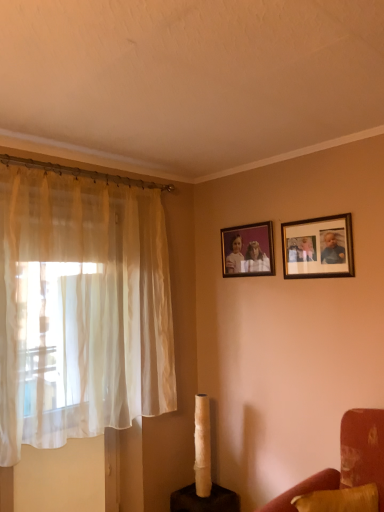
I want to click on matte wooden picture frame at upper center, which is counted as the 1th picture frame, starting from the back, so click(248, 250).

This screenshot has height=512, width=384. Describe the element at coordinates (248, 250) in the screenshot. I see `matte wooden picture frame at upper center, which is counted as the second picture frame, starting from the right` at that location.

You are a GUI agent. You are given a task and a screenshot of the screen. Output one action in this format:
    pyautogui.click(x=<x>, y=<y>)
    Task: Click on the velvet red couch at lower right
    
    Given the screenshot: What is the action you would take?
    pyautogui.click(x=304, y=490)

Based on the photo, is wooden photo frame at upper right, the second picture frame viewed from the back, further to camera compared to velvet red armchair at lower right?

Yes, the depth of wooden photo frame at upper right, the second picture frame viewed from the back, is greater than that of velvet red armchair at lower right.

Considering the relative positions of wooden photo frame at upper right, marked as the 1th picture frame in a front-to-back arrangement, and velvet red armchair at lower right in the image provided, is wooden photo frame at upper right, marked as the 1th picture frame in a front-to-back arrangement, to the right of velvet red armchair at lower right from the viewer's perspective?

Yes, wooden photo frame at upper right, marked as the 1th picture frame in a front-to-back arrangement, is to the right of velvet red armchair at lower right.

From the image's perspective, is wooden photo frame at upper right, the second picture frame when ordered from left to right, positioned above or below velvet red armchair at lower right?

Based on their image positions, wooden photo frame at upper right, the second picture frame when ordered from left to right, is located above velvet red armchair at lower right.

Is sheer white curtain at left positioned in front of velvet red couch at lower right?

That is False.

Is sheer white curtain at left inside the boundaries of velvet red couch at lower right, or outside?

sheer white curtain at left is spatially situated outside velvet red couch at lower right.

Does sheer white curtain at left have a larger size compared to velvet red couch at lower right?

Yes, sheer white curtain at left is bigger than velvet red couch at lower right.

Is sheer white curtain at left facing towards velvet red couch at lower right?

Yes, sheer white curtain at left is turned towards velvet red couch at lower right.

What's the angular difference between velvet red armchair at lower right and matte wooden picture frame at upper center, which is counted as the 1th picture frame, starting from the back,'s facing directions?

There is a 0.02-degree angle between the facing directions of velvet red armchair at lower right and matte wooden picture frame at upper center, which is counted as the 1th picture frame, starting from the back.

Is velvet red armchair at lower right behind matte wooden picture frame at upper center, which is counted as the 1th picture frame, starting from the back?

No, velvet red armchair at lower right is closer to the viewer.

Do you think velvet red armchair at lower right is within matte wooden picture frame at upper center, placed as the 1th picture frame when sorted from left to right, or outside of it?

velvet red armchair at lower right exists outside the volume of matte wooden picture frame at upper center, placed as the 1th picture frame when sorted from left to right.

Is velvet red armchair at lower right wider or thinner than matte wooden picture frame at upper center, placed as the 1th picture frame when sorted from left to right?

velvet red armchair at lower right is wider than matte wooden picture frame at upper center, placed as the 1th picture frame when sorted from left to right.

Which object is wider, wooden photo frame at upper right, the second picture frame viewed from the back, or matte wooden picture frame at upper center, which is counted as the 1th picture frame, starting from the back?

matte wooden picture frame at upper center, which is counted as the 1th picture frame, starting from the back, is wider.

From the image's perspective, which one is positioned higher, wooden photo frame at upper right, marked as the 1th picture frame in a front-to-back arrangement, or matte wooden picture frame at upper center, which is the 2th picture frame in front-to-back order?

matte wooden picture frame at upper center, which is the 2th picture frame in front-to-back order.

Is the position of wooden photo frame at upper right, which appears as the 1th picture frame when viewed from the right, more distant than that of matte wooden picture frame at upper center, which is counted as the second picture frame, starting from the right?

No, wooden photo frame at upper right, which appears as the 1th picture frame when viewed from the right, is in front of matte wooden picture frame at upper center, which is counted as the second picture frame, starting from the right.

Is wooden photo frame at upper right, which appears as the 1th picture frame when viewed from the right, at the back of velvet red armchair at lower right?

velvet red armchair at lower right is not turned away from wooden photo frame at upper right, which appears as the 1th picture frame when viewed from the right.

Considering the positions of points (383, 455) and (353, 262), is point (383, 455) closer to camera compared to point (353, 262)?

Yes, point (383, 455) is closer to viewer.

Does velvet red armchair at lower right touch wooden photo frame at upper right, the second picture frame when ordered from left to right?

They are not placed beside each other.

From the image's perspective, which is below, velvet red armchair at lower right or wooden photo frame at upper right, marked as the 1th picture frame in a front-to-back arrangement?

velvet red armchair at lower right appears lower in the image.

Is velvet red couch at lower right next to velvet red armchair at lower right and touching it?

No, velvet red couch at lower right is not with velvet red armchair at lower right.

Considering the points (327, 481) and (268, 509), which point is in front, point (327, 481) or point (268, 509)?

The point (268, 509) is closer to the camera.

Is velvet red couch at lower right smaller than velvet red armchair at lower right?

Yes, velvet red couch at lower right is smaller than velvet red armchair at lower right.

Relative to velvet red armchair at lower right, is velvet red couch at lower right in front or behind?

velvet red couch at lower right is positioned farther from the viewer than velvet red armchair at lower right.

From the image's perspective, does matte wooden picture frame at upper center, which is counted as the second picture frame, starting from the right, appear higher than velvet red couch at lower right?

Yes, from the image's perspective, matte wooden picture frame at upper center, which is counted as the second picture frame, starting from the right, is over velvet red couch at lower right.

In terms of width, does matte wooden picture frame at upper center, placed as the 1th picture frame when sorted from left to right, look wider or thinner when compared to velvet red couch at lower right?

Considering their sizes, matte wooden picture frame at upper center, placed as the 1th picture frame when sorted from left to right, looks slimmer than velvet red couch at lower right.

Does matte wooden picture frame at upper center, placed as the 1th picture frame when sorted from left to right, appear on the left side of velvet red couch at lower right?

Indeed, matte wooden picture frame at upper center, placed as the 1th picture frame when sorted from left to right, is positioned on the left side of velvet red couch at lower right.

Are matte wooden picture frame at upper center, which is the 2th picture frame in front-to-back order, and velvet red couch at lower right located far from each other?

Yes, matte wooden picture frame at upper center, which is the 2th picture frame in front-to-back order, and velvet red couch at lower right are quite far apart.

The width and height of the screenshot is (384, 512). I want to click on furniture below the wooden photo frame at upper right, the second picture frame viewed from the back (from a real-world perspective), so click(x=347, y=460).

At what (x,y) coordinates should I click in order to perform the action: click on couch below the sheer white curtain at left (from the image's perspective). Please return your answer as a coordinate pair (x, y). Looking at the image, I should click on (304, 490).

From the image, which object appears to be nearer to wooden photo frame at upper right, the second picture frame viewed from the back, sheer white curtain at left or matte wooden picture frame at upper center, placed as the 1th picture frame when sorted from left to right?

Among the two, matte wooden picture frame at upper center, placed as the 1th picture frame when sorted from left to right, is located nearer to wooden photo frame at upper right, the second picture frame viewed from the back.

From the image, which object appears to be farther from wooden photo frame at upper right, which appears as the 1th picture frame when viewed from the right, velvet red armchair at lower right or matte wooden picture frame at upper center, placed as the 1th picture frame when sorted from left to right?

Based on the image, velvet red armchair at lower right appears to be further to wooden photo frame at upper right, which appears as the 1th picture frame when viewed from the right.

When comparing their distances from wooden photo frame at upper right, marked as the 1th picture frame in a front-to-back arrangement, does velvet red couch at lower right or sheer white curtain at left seem further?

Among the two, velvet red couch at lower right is located further to wooden photo frame at upper right, marked as the 1th picture frame in a front-to-back arrangement.

Estimate the real-world distances between objects in this image. Which object is closer to matte wooden picture frame at upper center, placed as the 1th picture frame when sorted from left to right, velvet red armchair at lower right or velvet red couch at lower right?

The object closer to matte wooden picture frame at upper center, placed as the 1th picture frame when sorted from left to right, is velvet red armchair at lower right.

Based on their spatial positions, is wooden photo frame at upper right, the second picture frame when ordered from left to right, or matte wooden picture frame at upper center, placed as the 1th picture frame when sorted from left to right, closer to velvet red armchair at lower right?

wooden photo frame at upper right, the second picture frame when ordered from left to right, is closer to velvet red armchair at lower right.

Looking at the image, which one is located further to matte wooden picture frame at upper center, which is the 2th picture frame in front-to-back order, sheer white curtain at left or velvet red armchair at lower right?

velvet red armchair at lower right is positioned further to the anchor matte wooden picture frame at upper center, which is the 2th picture frame in front-to-back order.

When comparing their distances from velvet red couch at lower right, does matte wooden picture frame at upper center, which is counted as the 1th picture frame, starting from the back, or sheer white curtain at left seem closer?

The object closer to velvet red couch at lower right is matte wooden picture frame at upper center, which is counted as the 1th picture frame, starting from the back.

Estimate the real-world distances between objects in this image. Which object is further from velvet red couch at lower right, sheer white curtain at left or velvet red armchair at lower right?

Based on the image, sheer white curtain at left appears to be further to velvet red couch at lower right.

This screenshot has height=512, width=384. I want to click on curtain located between velvet red armchair at lower right and matte wooden picture frame at upper center, which is counted as the second picture frame, starting from the right, in the depth direction, so click(x=81, y=309).

The height and width of the screenshot is (512, 384). I want to click on couch between sheer white curtain at left and velvet red armchair at lower right in the horizontal direction, so click(304, 490).

The image size is (384, 512). Identify the location of picture frame located between sheer white curtain at left and wooden photo frame at upper right, the second picture frame when ordered from left to right, in the left-right direction. (248, 250).

At what (x,y) coordinates should I click in order to perform the action: click on furniture between wooden photo frame at upper right, which appears as the 1th picture frame when viewed from the right, and velvet red couch at lower right vertically. Please return your answer as a coordinate pair (x, y). This screenshot has height=512, width=384. Looking at the image, I should click on (347, 460).